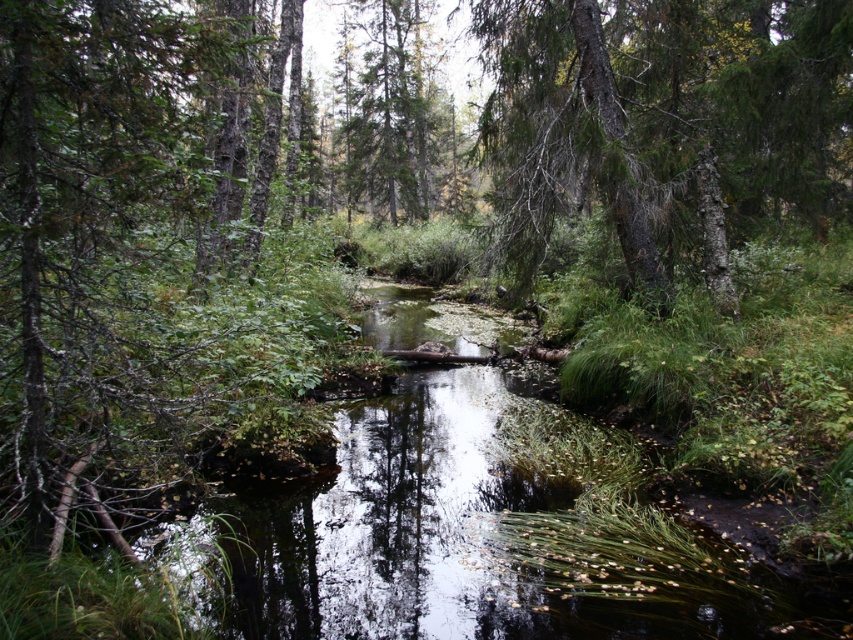
You are a hiker with a map that uses a coordinate system where the center of the image is at point 0.5, 0.5. You need to locate the clear water at center. What are its coordinates?

The clear water at center is located at coordinates (469, 538).

You are a hiker who wants to cross the stream. You see the clear water at center and the green textured tree at upper center. Which object is closer to you as you stand on the bank?

The clear water at center is closer to you because it is in front of the green textured tree at upper center.